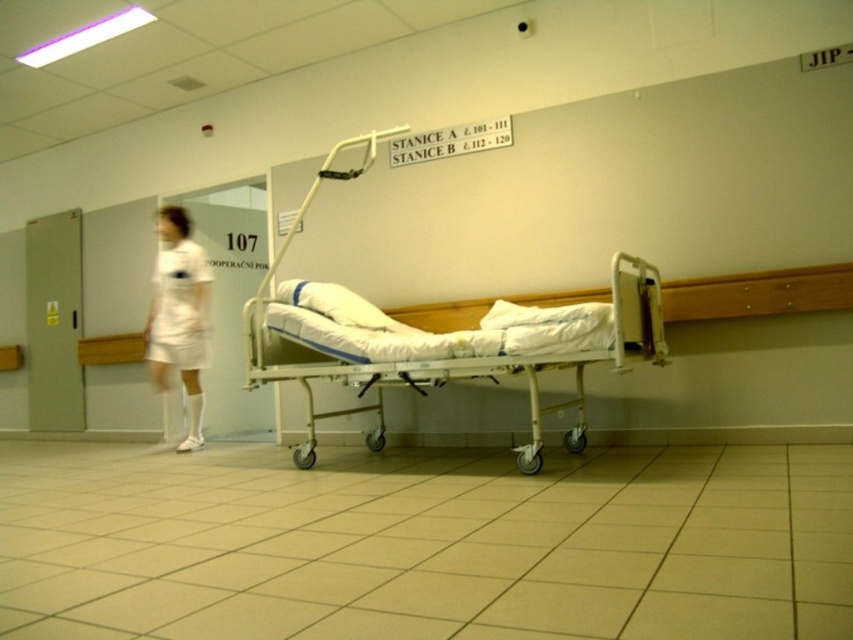
Question: Which object appears closest to the camera in this image?

Choices:
 (A) white matte uniform at left
 (B) white plastic hospital bed at center

Answer: (B)

Question: Can you confirm if white plastic hospital bed at center is positioned above white matte uniform at left?

Choices:
 (A) yes
 (B) no

Answer: (B)

Question: Which of the following is the closest to the observer?

Choices:
 (A) white plastic hospital bed at center
 (B) white matte uniform at left

Answer: (A)

Question: Does white plastic hospital bed at center appear under white matte uniform at left?

Choices:
 (A) yes
 (B) no

Answer: (A)

Question: Does white plastic hospital bed at center appear on the left side of white matte uniform at left?

Choices:
 (A) yes
 (B) no

Answer: (B)